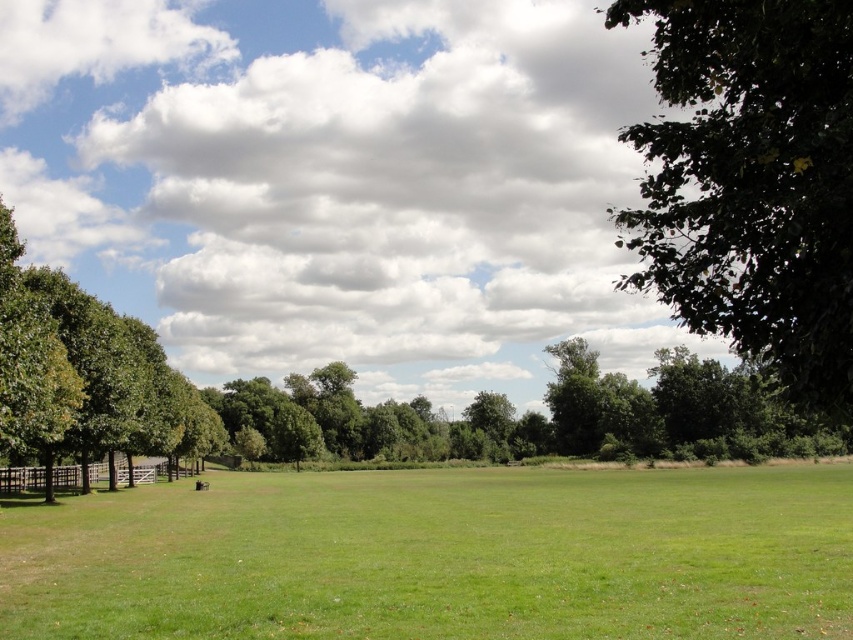
You are standing in the middle of the green grassy field at center and want to walk towards the green leafy tree at upper right. Which direction should you head?

You should head towards the upper right direction since the green leafy tree at upper right is further away from you compared to the green grassy field at center which is closer.

You are standing in the middle of the green grassy field at center and want to walk towards the green leafy tree at upper right. Which direction should you head?

You should head upwards towards the green leafy tree at upper right because the green grassy field at center is located below it.

You are standing in the field and see two points marked in the image. Which point is closer to you, point (546, 544) or point (814, 36)?

Point (546, 544) is closer to you because it is further to the viewer than point (814, 36).